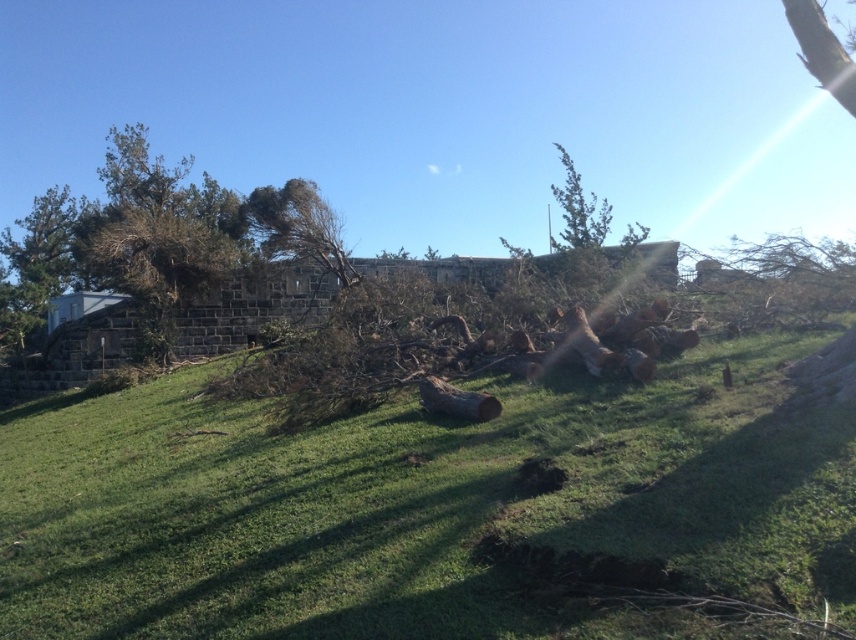
You are standing on the grassy hillside and want to walk from the green leafy tree at upper left to the brown rough log at center. Which direction should you head to reach the log?

To reach the brown rough log at center from the green leafy tree at upper left, you should head downward since the green leafy tree at upper left is located above the brown rough log at center.

You are standing on the green grassy at center and want to look up at the green leafy tree at upper left. In which direction should you look?

You should look upward because the green grassy at center is located below the green leafy tree at upper left, so looking upward will allow you to see it.